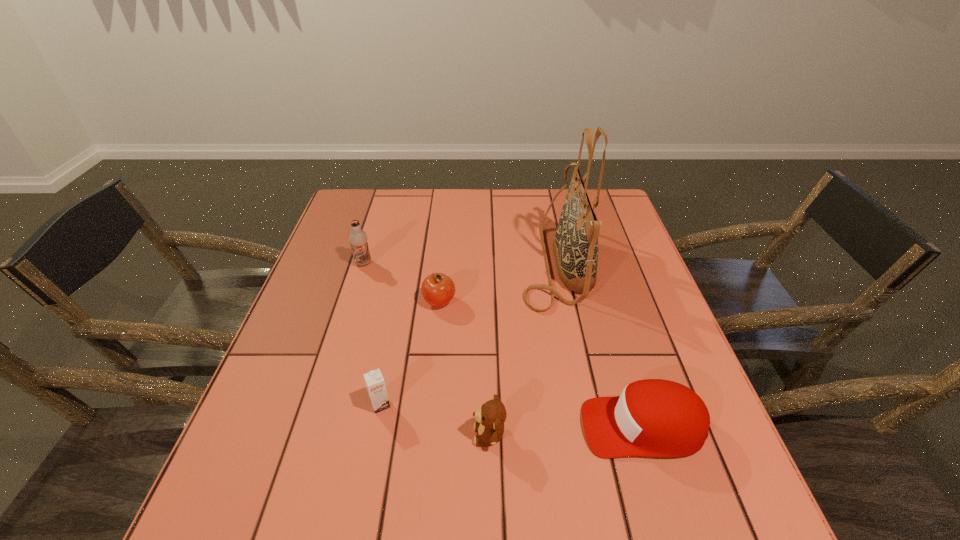
This screenshot has width=960, height=540. Find the location of `free spot between the teddy bear and the shorter chocolate milk`. free spot between the teddy bear and the shorter chocolate milk is located at coordinates (435, 420).

I want to click on blank region between the third object from right to left and the fourth object from right to left, so click(465, 368).

I want to click on vacant region between the apple and the shorter chocolate milk, so click(x=410, y=353).

In order to click on vacant space in between the baseball cap and the left chocolate milk in this screenshot , I will do `click(503, 345)`.

The image size is (960, 540). What are the coordinates of `vacant area that lies between the baseball cap and the left chocolate milk` in the screenshot? It's located at (503, 345).

This screenshot has height=540, width=960. What are the coordinates of `vacant area that lies between the baseball cap and the fourth object from left to right` in the screenshot? It's located at (566, 431).

Find the location of a particular element. This screenshot has height=540, width=960. blank region between the handbag and the third object from left to right is located at coordinates (497, 282).

Where is `free space that is in between the baseball cap and the tallest object`? Image resolution: width=960 pixels, height=540 pixels. free space that is in between the baseball cap and the tallest object is located at coordinates (599, 345).

I want to click on empty space between the handbag and the leftmost object, so click(x=460, y=263).

You are a GUI agent. You are given a task and a screenshot of the screen. Output one action in this format:
    pyautogui.click(x=<x>, y=<y>)
    Task: Click on the vacant area that lies between the teddy bear and the tallest object
    
    Given the screenshot: What is the action you would take?
    pyautogui.click(x=522, y=349)